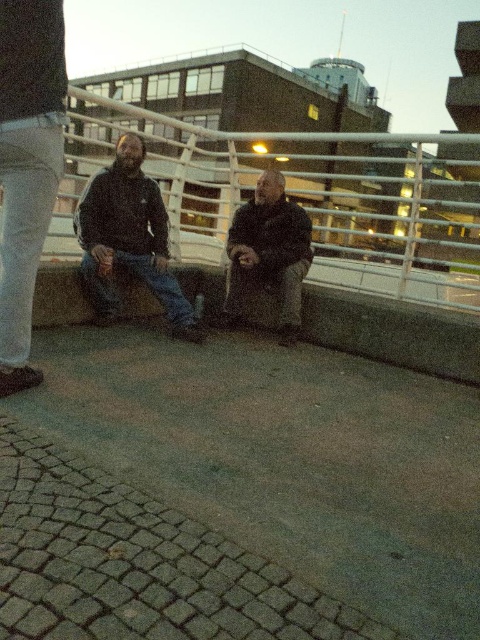
Question: Can you confirm if denim at left is positioned to the left of dark blue denim jeans at center?

Choices:
 (A) yes
 (B) no

Answer: (A)

Question: Which is farther from the dark gray sweater at center?

Choices:
 (A) white metal rail at center
 (B) dark blue denim jeans at center
 (C) jeans at left
 (D) denim at left

Answer: (A)

Question: Does dark gray sweater at center have a greater width compared to denim at left?

Choices:
 (A) no
 (B) yes

Answer: (B)

Question: Can you confirm if jeans at left is wider than dark brown leather jacket at center?

Choices:
 (A) yes
 (B) no

Answer: (B)

Question: Which object is positioned closest to the dark blue denim jeans at center?

Choices:
 (A) dark gray sweater at center
 (B) white metal rail at center
 (C) dark brown leather jacket at center
 (D) jeans at left

Answer: (C)

Question: Which point is closer to the camera taking this photo?

Choices:
 (A) (302, 147)
 (B) (299, 276)
 (C) (23, 147)

Answer: (C)